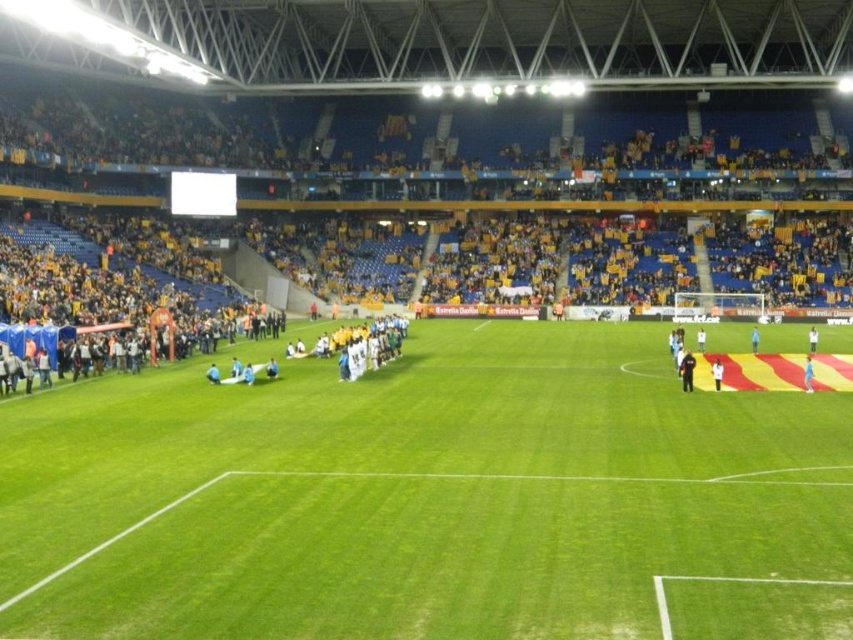
You are a photographer positioned at the edge of the soccer field. You need to capture a photo that includes both the black uniformed official at center and the white fabric person at center. What is the minimum distance you should set your camera lens to ensure both subjects are in frame?

The minimum distance required is 14.20 meters between the black uniformed official at center and the white fabric person at center to ensure both are in frame.

You are a photographer positioned at the edge of the soccer field. You want to take a photo that includes both the white fabric person at center and the blue fabric person at center. Which of the two will appear larger in the photo?

The white fabric person at center will appear larger in the photo because they are closer to the viewer than the blue fabric person at center.

You are a photographer standing at the edge of the soccer field. You need to capture a photo where both the white fabric person at center and the blue fabric person at center are visible. Which person should you focus on first to ensure both are in frame?

You should focus on the white fabric person at center first because it is wider than the blue fabric person at center, so ensuring it fits will also accommodate the narrower blue fabric person at center.